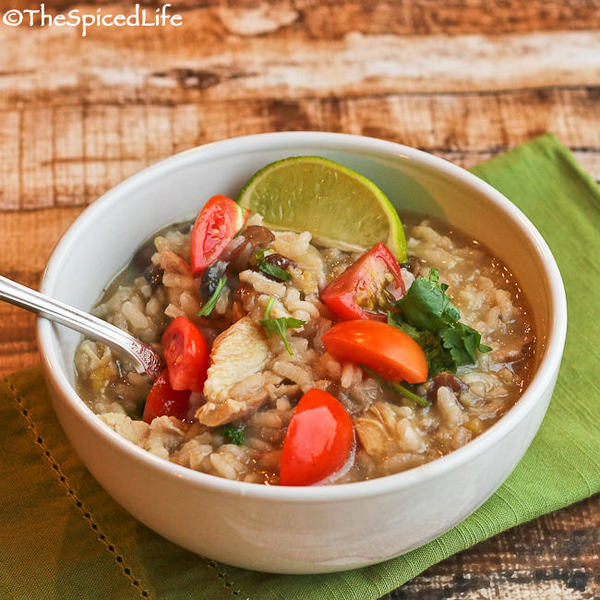
Locate an element on the screen. Image resolution: width=600 pixels, height=600 pixels. wooden table is located at coordinates (149, 129).